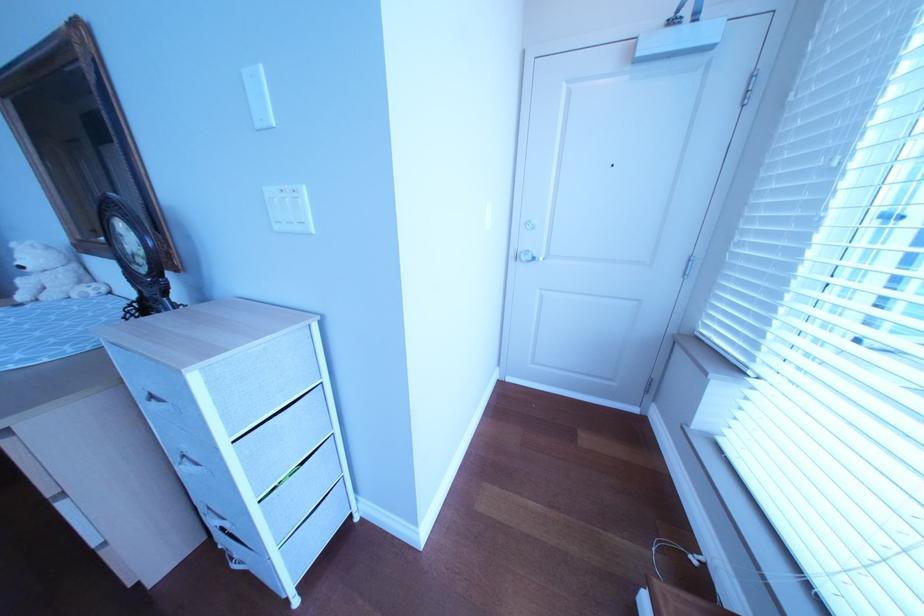
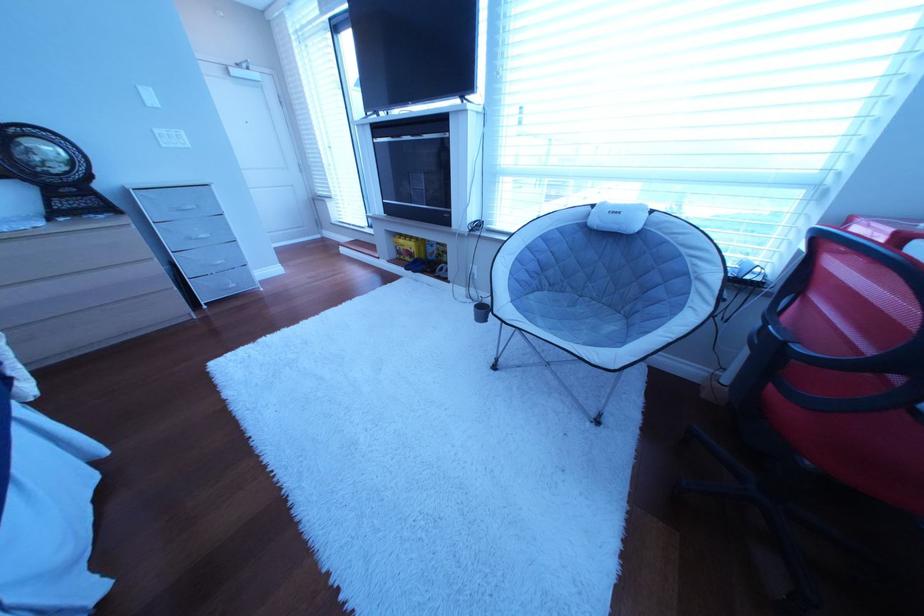
Find the pixel in the second image that matches point (292, 229) in the first image.

(179, 148)